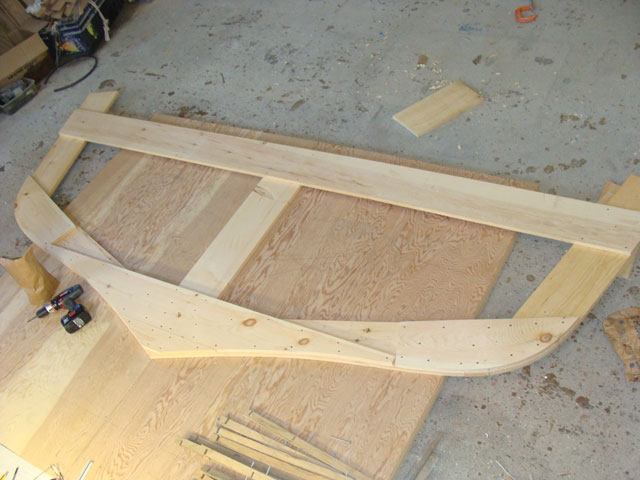
This screenshot has height=480, width=640. I want to click on wooden planks, so click(x=276, y=464).